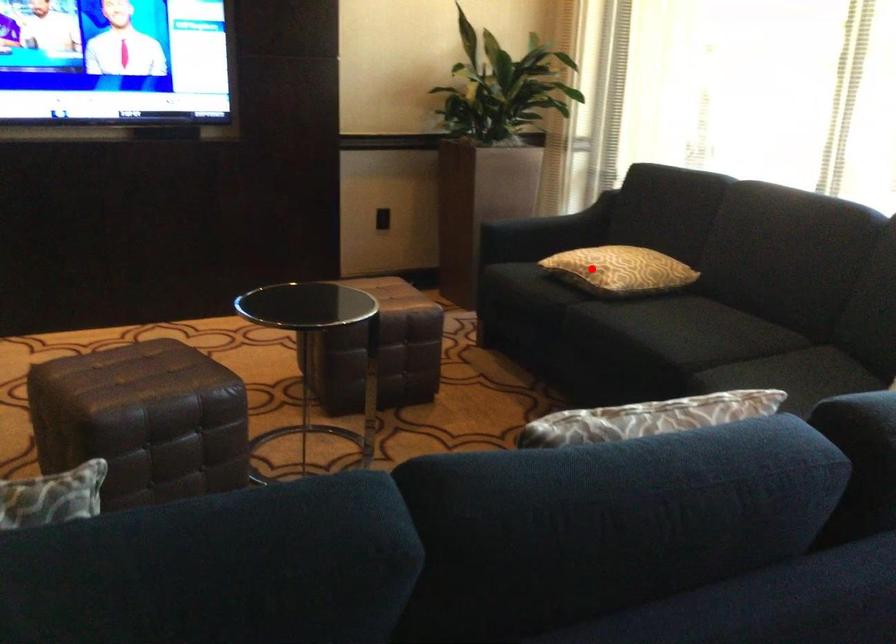
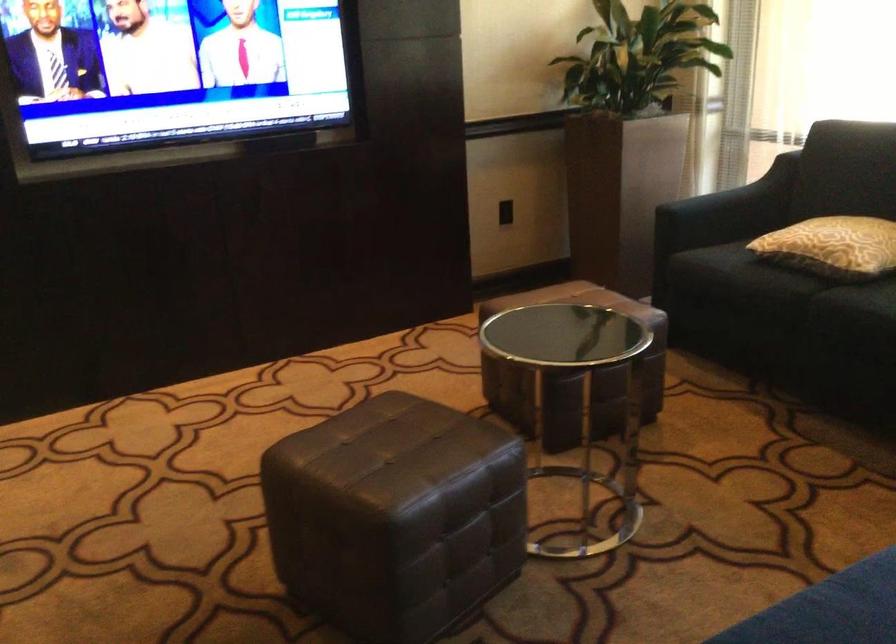
Where in the second image is the point corresponding to the highlighted location from the first image?

(832, 245)